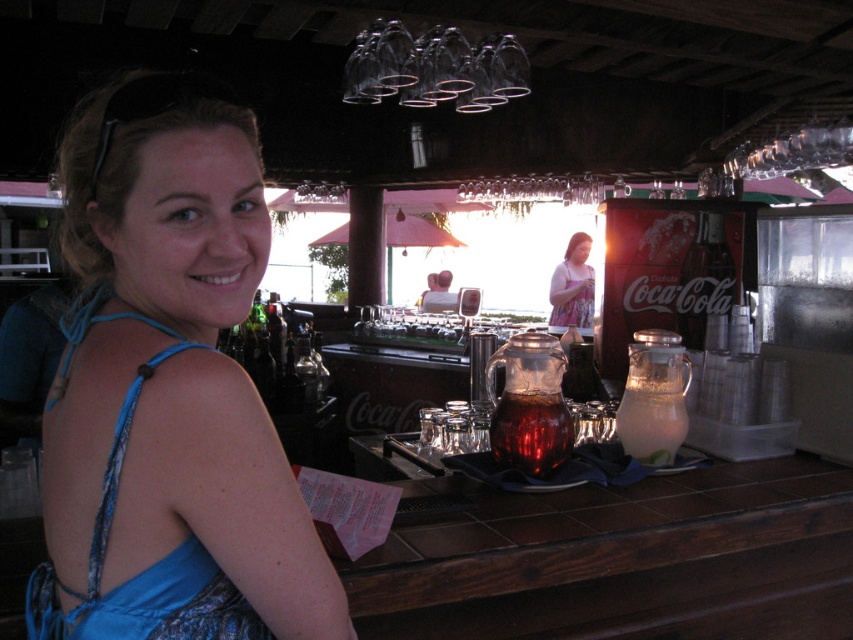
Question: Estimate the real-world distances between objects in this image. Which object is closer to the blue satin dress at left?

Choices:
 (A) pink floral dress at center
 (B) translucent glass pitcher at center
 (C) clear glass pitcher at center

Answer: (B)

Question: Is blue satin dress at left bigger than pink floral dress at center?

Choices:
 (A) yes
 (B) no

Answer: (B)

Question: Which object appears closest to the camera in this image?

Choices:
 (A) translucent glass pitcher at center
 (B) clear glass pitcher at center

Answer: (A)

Question: Is blue fabric dress at left thinner than pink floral dress at center?

Choices:
 (A) no
 (B) yes

Answer: (A)

Question: Is blue fabric dress at left in front of translucent glass pitcher at center?

Choices:
 (A) yes
 (B) no

Answer: (A)

Question: Estimate the real-world distances between objects in this image. Which object is farther from the translucent glass pitcher at center?

Choices:
 (A) clear glass pitcher at center
 (B) blue fabric dress at left
 (C) pink floral dress at center

Answer: (C)